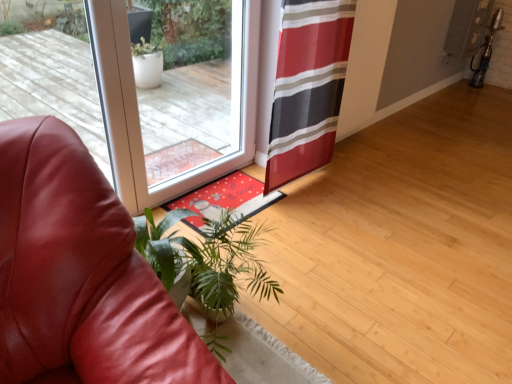
Identify the location of vacant area that is situated to the right of green leafy plant at lower left. Image resolution: width=512 pixels, height=384 pixels. point(320,329).